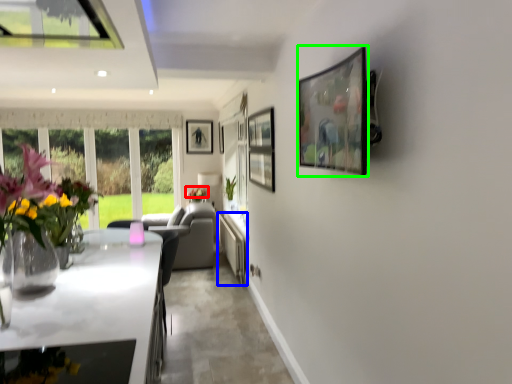
Question: Estimate the real-world distances between objects in this image. Which object is farther from flower (highlighted by a red box), counter top (highlighted by a blue box) or picture frame (highlighted by a green box)?

Choices:
 (A) counter top
 (B) picture frame

Answer: (B)